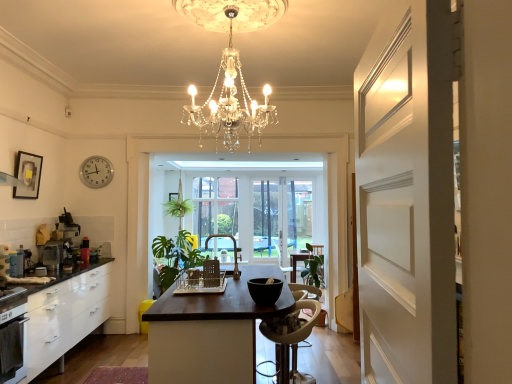
Describe the element at coordinates (211, 273) in the screenshot. Image resolution: width=512 pixels, height=384 pixels. I see `metallic silver chair at center, the second chair when ordered from bottom to top` at that location.

This screenshot has width=512, height=384. Describe the element at coordinates (289, 342) in the screenshot. I see `white plastic chair at center, which is the third chair in top-to-bottom order` at that location.

What is the approximate width of metallic silver toaster at left, which is the second appliance in back-to-front order?

The width of metallic silver toaster at left, which is the second appliance in back-to-front order, is 3.98 inches.

Where is `white matte door at right`? The height and width of the screenshot is (384, 512). white matte door at right is located at coordinates (407, 197).

The height and width of the screenshot is (384, 512). I want to click on black matte oven at lower left, so click(12, 350).

Locate an element on the screen. This screenshot has height=384, width=512. metallic silver chair at center, the second chair when ordered from bottom to top is located at coordinates tap(211, 273).

In the image, is clear glass window at center, the first window screen positioned from the left, positioned in front of or behind green leafy plant at center?

Visually, clear glass window at center, the first window screen positioned from the left, is located behind green leafy plant at center.

Is clear glass window at center, the first window screen positioned from the left, next to green leafy plant at center?

No, clear glass window at center, the first window screen positioned from the left, is not with green leafy plant at center.

From the image's perspective, is clear glass window at center, the second window screen from the right, over green leafy plant at center?

Yes, from the image's perspective, clear glass window at center, the second window screen from the right, is over green leafy plant at center.

Which point is more forward, (237, 198) or (182, 262)?

The point (182, 262) is closer to the camera.

Considering the positions of objects clear plastic screen at center, acting as the first window screen starting from the right, and white glossy cabinetry at left in the image provided, who is in front, clear plastic screen at center, acting as the first window screen starting from the right, or white glossy cabinetry at left?

white glossy cabinetry at left is more forward.

Who is bigger, clear plastic screen at center, acting as the first window screen starting from the right, or white glossy cabinetry at left?

Bigger between the two is white glossy cabinetry at left.

Is clear plastic screen at center, acting as the 2th window screen starting from the left, wider than white glossy cabinetry at left?

No, clear plastic screen at center, acting as the 2th window screen starting from the left, is not wider than white glossy cabinetry at left.

Does clear plastic screen at center, acting as the first window screen starting from the right, contain white glossy cabinetry at left?

That's incorrect, white glossy cabinetry at left is not inside clear plastic screen at center, acting as the first window screen starting from the right.

There is a matte black picture frame at upper left. Where is `the 2nd chair below it (from the image's perspective)`? This screenshot has width=512, height=384. the 2nd chair below it (from the image's perspective) is located at coordinates (211, 273).

Considering the relative sizes of metallic silver chair at center, which appears as the second chair when viewed from the back, and matte black picture frame at upper left in the image provided, is metallic silver chair at center, which appears as the second chair when viewed from the back, wider than matte black picture frame at upper left?

Correct, the width of metallic silver chair at center, which appears as the second chair when viewed from the back, exceeds that of matte black picture frame at upper left.

From the image's perspective, is metallic silver chair at center, which appears as the second chair when viewed from the back, above or below matte black picture frame at upper left?

metallic silver chair at center, which appears as the second chair when viewed from the back, is situated lower than matte black picture frame at upper left in the image.

Which of these two, metallic silver chair at center, acting as the 2th chair starting from the top, or matte black picture frame at upper left, stands shorter?

metallic silver chair at center, acting as the 2th chair starting from the top, is shorter.

Is black matte oven at lower left to the left of metallic silver toaster at left, which is the second appliance in back-to-front order, from the viewer's perspective?

Incorrect, black matte oven at lower left is not on the left side of metallic silver toaster at left, which is the second appliance in back-to-front order.

Is black matte oven at lower left not within metallic silver toaster at left, marked as the 1th appliance in a left-to-right arrangement?

black matte oven at lower left lies outside metallic silver toaster at left, marked as the 1th appliance in a left-to-right arrangement,'s area.

From the image's perspective, count 1st appliances upward from the black matte oven at lower left and point to it. Please provide its 2D coordinates.

[(16, 263)]

Is black matte oven at lower left taller than metallic silver toaster at left, which is the second appliance in back-to-front order?

Yes, black matte oven at lower left is taller than metallic silver toaster at left, which is the second appliance in back-to-front order.

Which is more to the left, metallic silver chair at center, positioned as the 3th chair in right-to-left order, or metallic silver toaster at left, the 3th appliance when ordered from right to left?

Positioned to the left is metallic silver toaster at left, the 3th appliance when ordered from right to left.

Could you tell me if metallic silver chair at center, acting as the 2th chair starting from the top, is facing metallic silver toaster at left, acting as the second appliance starting from the front?

No.

Is metallic silver chair at center, which appears as the second chair when viewed from the back, not close to metallic silver toaster at left, acting as the second appliance starting from the front?

Yes, metallic silver chair at center, which appears as the second chair when viewed from the back, is far from metallic silver toaster at left, acting as the second appliance starting from the front.

From the image's perspective, relative to matte gold faucet at center, the 3th chair from the front, is white plastic chair at center, which is the third chair in top-to-bottom order, above or below?

Clearly, from the image's perspective, white plastic chair at center, which is the third chair in top-to-bottom order, is below matte gold faucet at center, the 3th chair from the front.

Which is more distant, (279, 346) or (228, 237)?

Point (228, 237)

In terms of size, does white plastic chair at center, which is the 1th chair from right to left, appear bigger or smaller than matte gold faucet at center, arranged as the 2th chair when viewed from the left?

Clearly, white plastic chair at center, which is the 1th chair from right to left, is larger in size than matte gold faucet at center, arranged as the 2th chair when viewed from the left.

Is matte black picture frame at upper left next to metallic silver toaster at left, which is the second appliance in back-to-front order?

No, matte black picture frame at upper left is not with metallic silver toaster at left, which is the second appliance in back-to-front order.

Does matte black picture frame at upper left come behind metallic silver toaster at left, marked as the 1th appliance in a left-to-right arrangement?

Yes, it is behind metallic silver toaster at left, marked as the 1th appliance in a left-to-right arrangement.

Between matte black picture frame at upper left and metallic silver toaster at left, acting as the second appliance starting from the front, which one has less height?

With less height is metallic silver toaster at left, acting as the second appliance starting from the front.

From the image's perspective, is matte black picture frame at upper left located above metallic silver toaster at left, which is the second appliance in back-to-front order?

Indeed, from the image's perspective, matte black picture frame at upper left is shown above metallic silver toaster at left, which is the second appliance in back-to-front order.

Locate an element on the screen. This screenshot has width=512, height=384. plant below the clear glass window at center, the first window screen positioned from the left (from the image's perspective) is located at coordinates (176, 256).

The image size is (512, 384). What are the coordinates of `cabinetry on the left side of clear plastic screen at center, acting as the first window screen starting from the right` in the screenshot? It's located at (65, 315).

Based on their spatial positions, is white plastic chair at center, which is the 1th chair from right to left, or clear plastic screen at center, acting as the first window screen starting from the right, closer to green leafy plant at center?

clear plastic screen at center, acting as the first window screen starting from the right, is closer to green leafy plant at center.

Which object lies further to the anchor point dark brown wood table at center, black matte oven at lower left or black matte bowl at center, which is the first appliance in front-to-back order?

black matte oven at lower left lies further to dark brown wood table at center than the other object.

Consider the image. From the image, which object appears to be nearer to green leafy plant at center, metallic silver toaster at left, marked as the 1th appliance in a left-to-right arrangement, or matte gold faucet at center, positioned as the 1th chair in top-to-bottom order?

Based on the image, matte gold faucet at center, positioned as the 1th chair in top-to-bottom order, appears to be nearer to green leafy plant at center.

Based on their spatial positions, is green leafy plant at center or clear glass window at center, the second window screen from the right, further from white plastic clock at upper left?

clear glass window at center, the second window screen from the right, is further to white plastic clock at upper left.

Considering their positions, is clear glass window at center, the first window screen positioned from the left, positioned further to green leafy plant at center than metallic silver blender at left, which appears as the 2th appliance when viewed from the left?

metallic silver blender at left, which appears as the 2th appliance when viewed from the left, is positioned further to the anchor green leafy plant at center.

Which object lies nearer to the anchor point metallic silver toaster at left, acting as the second appliance starting from the front, black matte bowl at center, which appears as the first appliance when viewed from the right, or clear glass window at center, the first window screen positioned from the left?

black matte bowl at center, which appears as the first appliance when viewed from the right, is closer to metallic silver toaster at left, acting as the second appliance starting from the front.

Which object lies nearer to the anchor point clear glass window at center, the second window screen from the right, black matte oven at lower left or matte black picture frame at upper left?

matte black picture frame at upper left is closer to clear glass window at center, the second window screen from the right.

Estimate the real-world distances between objects in this image. Which object is further from matte gold faucet at center, the 3th chair from the front, clear plastic screen at center, acting as the 2th window screen starting from the left, or white glossy cabinetry at left?

white glossy cabinetry at left lies further to matte gold faucet at center, the 3th chair from the front, than the other object.

You are a GUI agent. You are given a task and a screenshot of the screen. Output one action in this format:
    pyautogui.click(x=<x>, y=<y>)
    Task: Click on the cabinetry located between metallic silver blender at left, the first appliance when ordered from back to front, and dark brown wood table at center in the left-right direction
    This screenshot has height=384, width=512.
    Given the screenshot: What is the action you would take?
    pyautogui.click(x=65, y=315)

Find the location of a particular element. The height and width of the screenshot is (384, 512). cabinetry situated between metallic silver toaster at left, the 3th appliance when ordered from right to left, and metallic silver chair at center, positioned as the 3th chair in right-to-left order, from left to right is located at coordinates pyautogui.click(x=65, y=315).

Where is `plant located between white glossy cabinetry at left and clear glass window at center, the first window screen positioned from the left, in the depth direction`? This screenshot has height=384, width=512. plant located between white glossy cabinetry at left and clear glass window at center, the first window screen positioned from the left, in the depth direction is located at coordinates (176, 256).

Locate an element on the screen. The height and width of the screenshot is (384, 512). window screen located between matte gold faucet at center, marked as the 2th chair in a right-to-left arrangement, and clear plastic screen at center, acting as the 2th window screen starting from the left, in the depth direction is located at coordinates (215, 206).